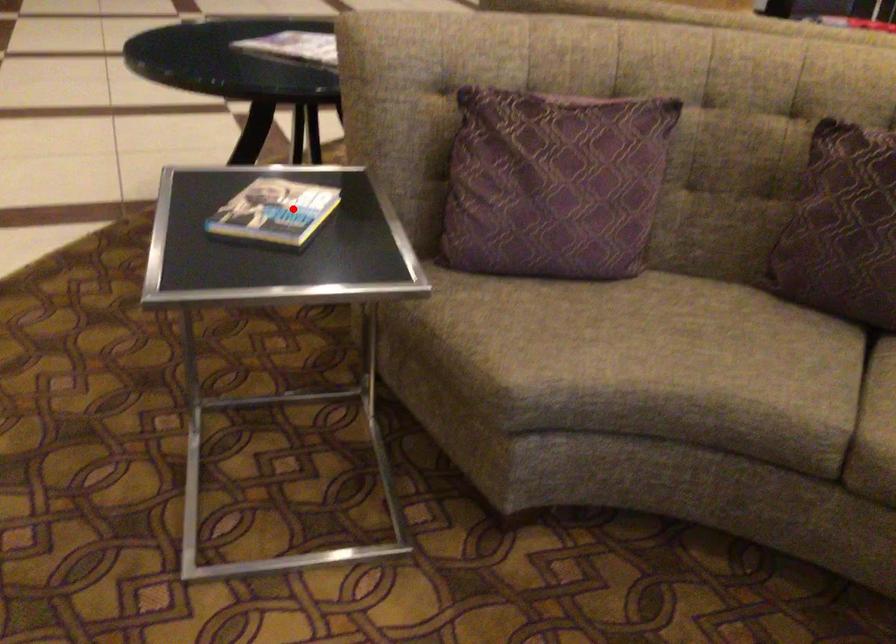
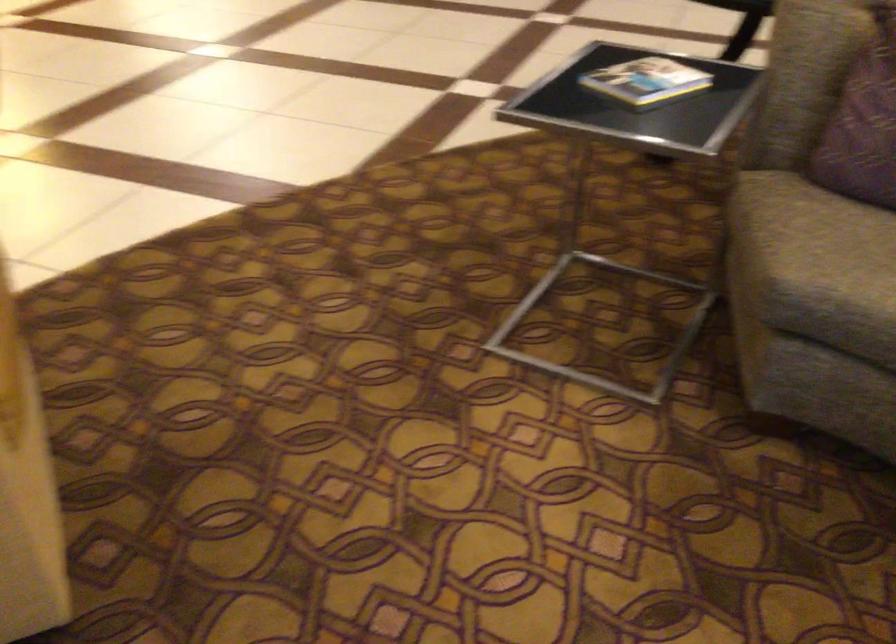
Question: A red point is marked in image1. In image2, is the corresponding 3D point closer to the camera or farther? Reply with the corresponding letter.

Choices:
 (A) The corresponding 3D point is closer.
 (B) The corresponding 3D point is farther.

Answer: (B)